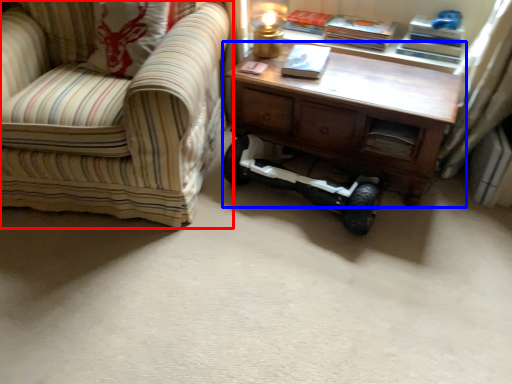
Question: Which object is closer to the camera taking this photo, chair (highlighted by a red box) or table (highlighted by a blue box)?

Choices:
 (A) chair
 (B) table

Answer: (A)